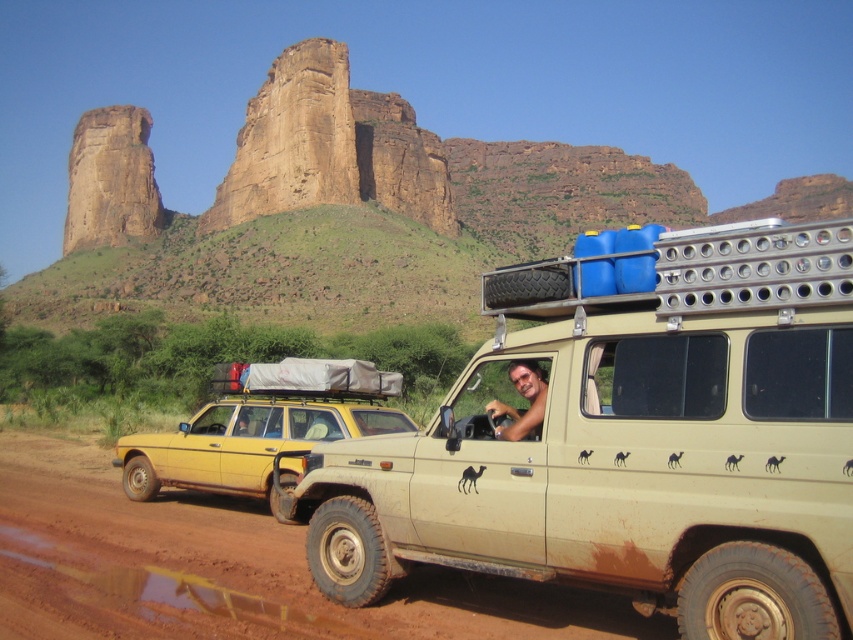
You are a passenger in the beige SUV and notice two points marked on the road ahead. The first point is at coordinates point [450,486] and the second is at point [181,568]. Which point will the SUV reach first as it continues driving forward?

The SUV will reach point [450,486] first because it is in front of point [181,568] along the road.